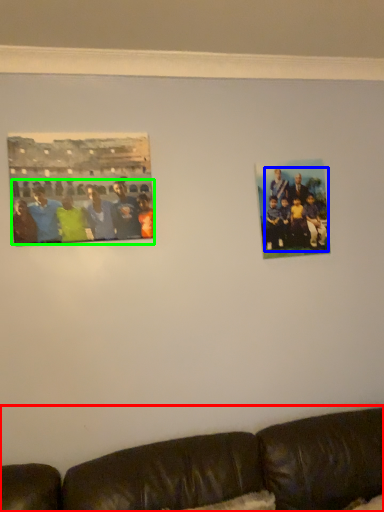
Question: Estimate the real-world distances between objects in this image. Which object is farther from studio couch (highlighted by a red box), person (highlighted by a blue box) or person (highlighted by a green box)?

Choices:
 (A) person
 (B) person

Answer: (B)